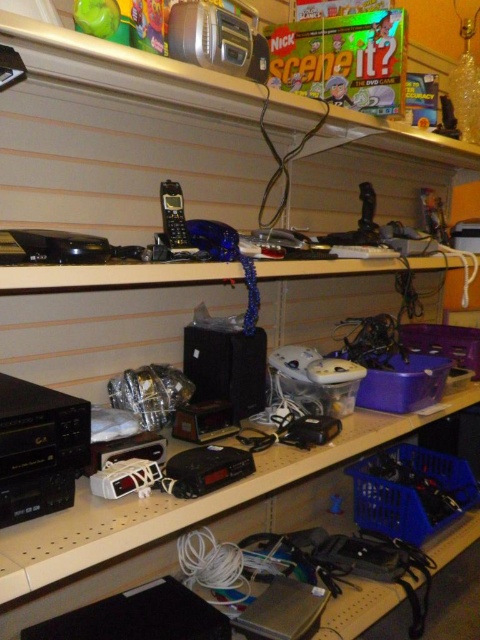
Question: Does black plastic speaker at center appear on the right side of matte black phone at center?

Choices:
 (A) no
 (B) yes

Answer: (B)

Question: Which point is closer to the camera?

Choices:
 (A) metallic silver radio at upper center
 (B) matte black phone at center
 (C) black plastic speaker at center
 (D) black plastic computer desk at center

Answer: (A)

Question: Which object appears closest to the camera in this image?

Choices:
 (A) metallic silver radio at upper center
 (B) metallic silver alarm clock at center
 (C) matte black phone at center
 (D) black plastic clock at center

Answer: (D)

Question: Does black plastic computer desk at center come in front of black plastic clock at center?

Choices:
 (A) yes
 (B) no

Answer: (B)

Question: Is black plastic clock at center smaller than metallic silver alarm clock at center?

Choices:
 (A) yes
 (B) no

Answer: (B)

Question: Which point is farther to the camera?

Choices:
 (A) (220, 54)
 (B) (211, 348)

Answer: (B)